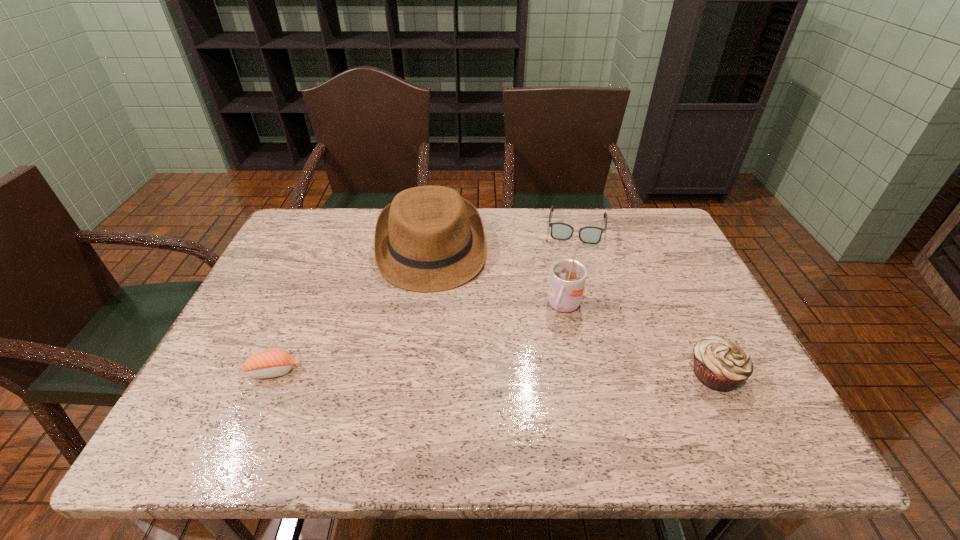
The width and height of the screenshot is (960, 540). Find the location of `vacant space on the desktop that is between the leftmost object and the muffin and is positioned on the face of the spectacles`. vacant space on the desktop that is between the leftmost object and the muffin and is positioned on the face of the spectacles is located at coordinates 558,373.

Image resolution: width=960 pixels, height=540 pixels. Identify the location of vacant space on the desktop that is between the leftmost object and the muffin and is positioned on the side with the handle of the cup. (536, 373).

I want to click on vacant space on the desktop that is between the leftmost object and the muffin and is positioned on the front-facing side of the fedora, so click(442, 373).